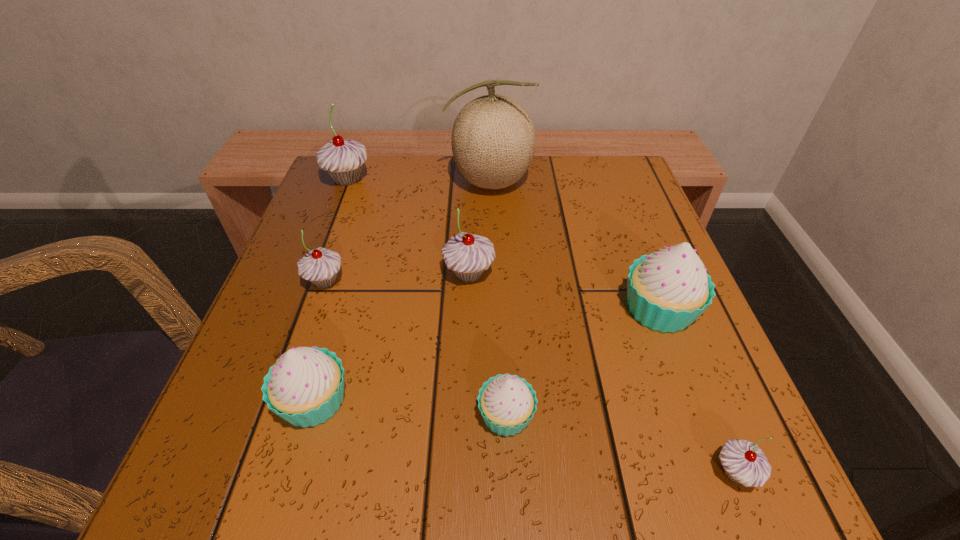
The width and height of the screenshot is (960, 540). Find the location of `the nearest gray cupcake`. the nearest gray cupcake is located at coordinates (743, 462).

Find the location of a particular element. The height and width of the screenshot is (540, 960). vacant region located 0.190m on the left of the cantaloup is located at coordinates (367, 182).

Where is `vacant space located 0.400m on the right of the seventh shortest object`? vacant space located 0.400m on the right of the seventh shortest object is located at coordinates (539, 179).

This screenshot has height=540, width=960. Find the location of `vacant area situated on the right of the second gray cupcake from right to left`. vacant area situated on the right of the second gray cupcake from right to left is located at coordinates (601, 274).

You are a GUI agent. You are given a task and a screenshot of the screen. Output one action in this format:
    pyautogui.click(x=<x>, y=<y>)
    Task: Click on the blank space located on the back of the farthest white cupcake
    The width and height of the screenshot is (960, 540).
    Given the screenshot: What is the action you would take?
    pyautogui.click(x=608, y=174)

At what (x,y) coordinates should I click in order to perform the action: click on vacant position located on the back of the third biggest gray cupcake. Please return your answer as a coordinate pair (x, y). This screenshot has height=540, width=960. Looking at the image, I should click on (357, 190).

I want to click on vacant space located on the right of the leftmost white cupcake, so click(x=537, y=401).

The image size is (960, 540). In order to click on free space located on the left of the second white cupcake from right to left in this screenshot , I will do `click(309, 415)`.

The width and height of the screenshot is (960, 540). I want to click on free space located 0.060m on the back of the nearest object, so click(709, 409).

Where is `cantaloup at the far edge`? The width and height of the screenshot is (960, 540). cantaloup at the far edge is located at coordinates (493, 139).